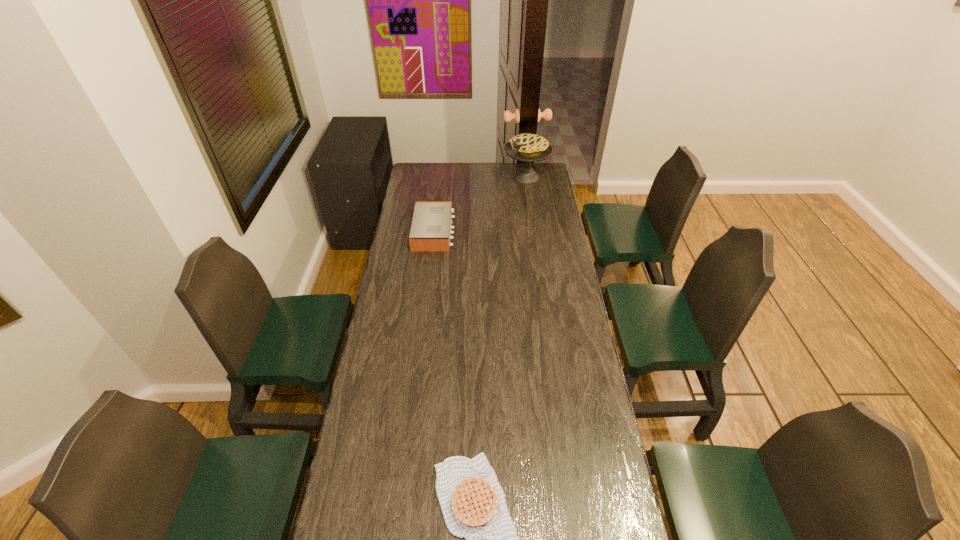
Locate an element on the screen. object located at the right edge is located at coordinates (526, 147).

Where is `object present at the far right corner`? Image resolution: width=960 pixels, height=540 pixels. object present at the far right corner is located at coordinates (526, 147).

Where is `free space at the far edge`? The image size is (960, 540). free space at the far edge is located at coordinates (473, 166).

The image size is (960, 540). I want to click on free space at the left edge, so click(354, 449).

At what (x,y) coordinates should I click in order to perform the action: click on vacant space at the right edge of the desktop. Please return your answer as a coordinate pair (x, y). This screenshot has width=960, height=540. Looking at the image, I should click on (559, 447).

The image size is (960, 540). In the image, there is a desktop. Find the location of `blank space at the far left corner`. blank space at the far left corner is located at coordinates (420, 174).

The width and height of the screenshot is (960, 540). I want to click on vacant space at the far right corner of the desktop, so click(551, 180).

Image resolution: width=960 pixels, height=540 pixels. Identify the location of empty space that is in between the farther pie and the second shortest object. (480, 205).

Where is `free space between the farther pie and the radio receiver`? The width and height of the screenshot is (960, 540). free space between the farther pie and the radio receiver is located at coordinates (480, 205).

The image size is (960, 540). Identify the location of vacant area between the radio receiver and the farther pie. (480, 205).